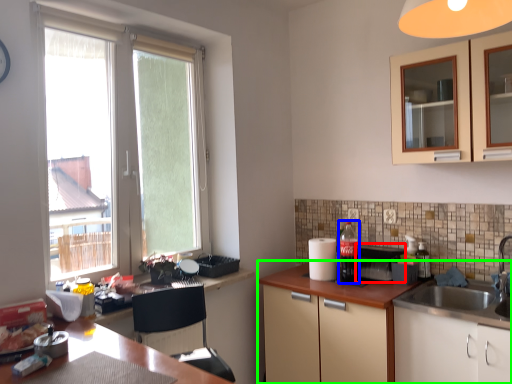
Question: Considering the real-world distances, which object is farthest from appliance (highlighted by a red box)? beverage (highlighted by a blue box) or cabinetry (highlighted by a green box)?

Choices:
 (A) beverage
 (B) cabinetry

Answer: (B)